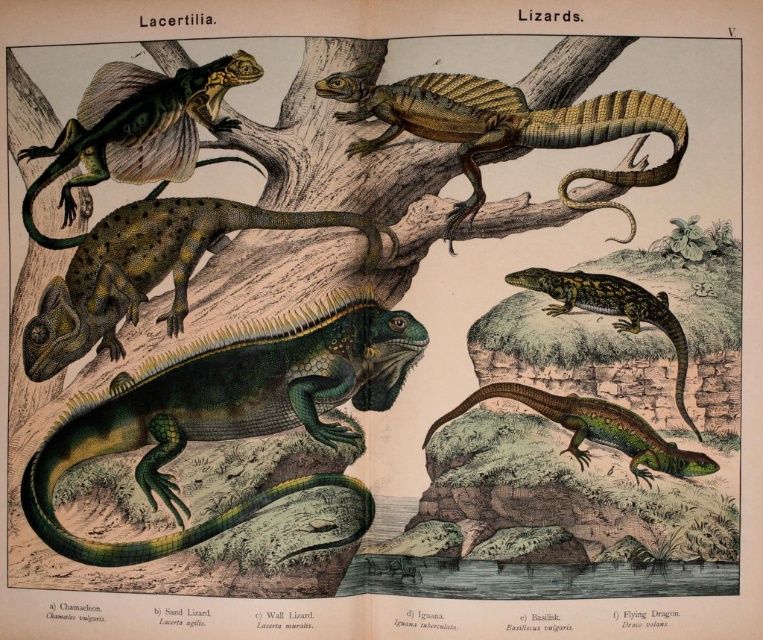
You are observing the lizard illustration and want to know which of the two points, point (298, 488) or point (427, 120), appears closer to you. Based on the illustration, which point is nearer?

Point (298, 488) is closer to the camera than point (427, 120), so it appears nearer to you.

You are an animal researcher examining the scales of two lizards in the illustration. You notice the spotted green scales at center and the shiny green scales at upper left. Which of these scales is bigger in size?

The spotted green scales at center has a larger size compared to the shiny green scales at upper left.

Looking at the image of Lacertilia, you see a green scaly iguana at center and a shiny green scales at upper center. Which of these two objects is positioned to the left?

The green scaly iguana at center is positioned to the left of the shiny green scales at upper center.